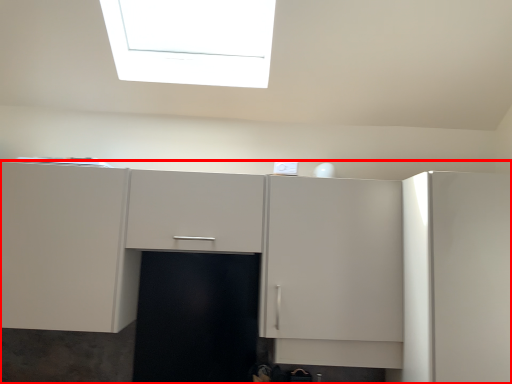
Question: Considering the relative positions of cabinetry (annotated by the red box) and cabinetry in the image provided, where is cabinetry (annotated by the red box) located with respect to the staircase?

Choices:
 (A) right
 (B) left

Answer: (B)